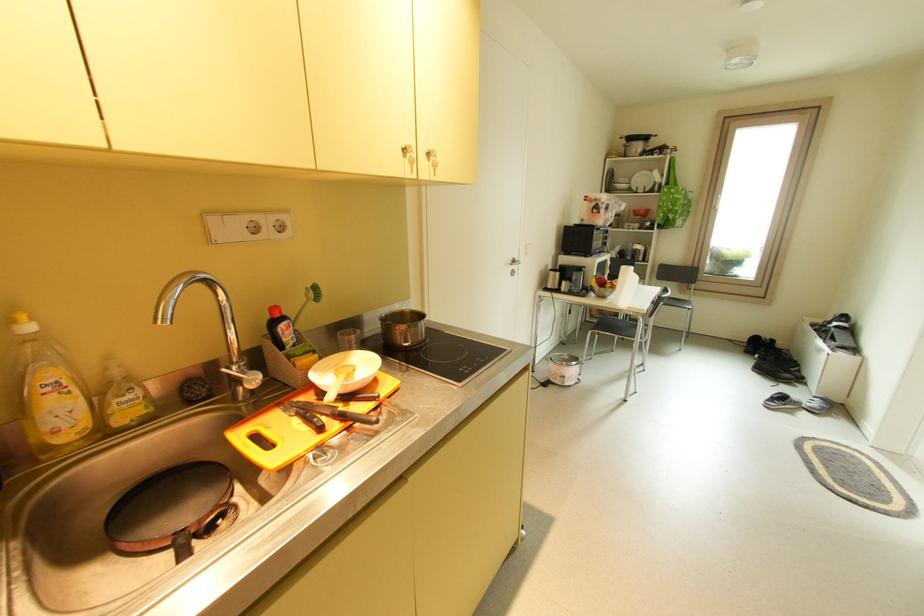
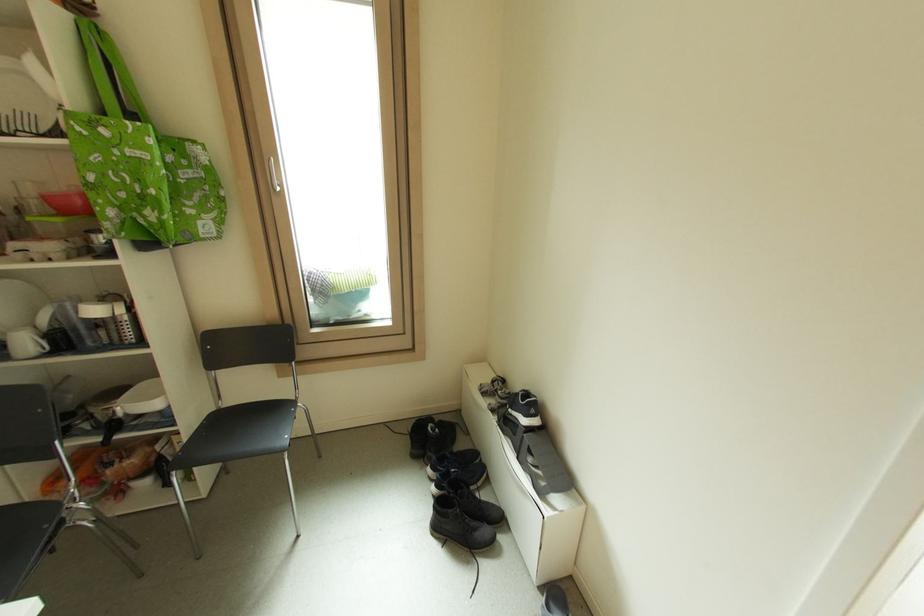
In the second image, find the point that corresponds to pixel 794 377 in the first image.

(490, 532)